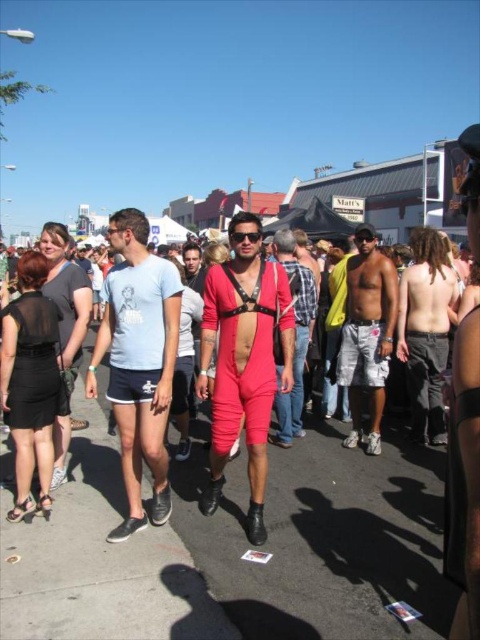
Question: Which object appears farthest from the camera in this image?

Choices:
 (A) rubberized red pants at center
 (B) matte red shorts at center
 (C) black plastic goggles at center
 (D) white cotton shorts at center

Answer: (D)

Question: In this image, where is black sheer dress at lower left located relative to black matte dress at left?

Choices:
 (A) below
 (B) above

Answer: (A)

Question: Is black sheer dress at lower left below dark gray pants at center?

Choices:
 (A) yes
 (B) no

Answer: (A)

Question: Estimate the real-world distances between objects in this image. Which object is closer to the matte red jumpsuit at center?

Choices:
 (A) black matte dress at left
 (B) black plastic goggles at center
 (C) dark gray pants at center

Answer: (B)

Question: Observing the image, what is the correct spatial positioning of matte red jumpsuit at center in reference to black sheer dress at lower left?

Choices:
 (A) above
 (B) below

Answer: (A)

Question: Which point is farther to the camera?

Choices:
 (A) black plastic goggles at center
 (B) black sheer dress at lower left

Answer: (A)